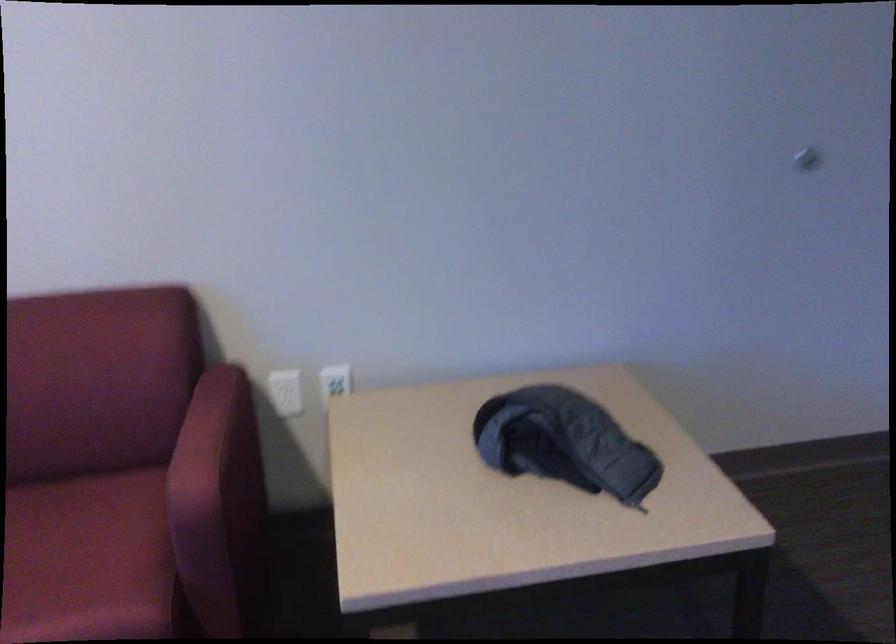
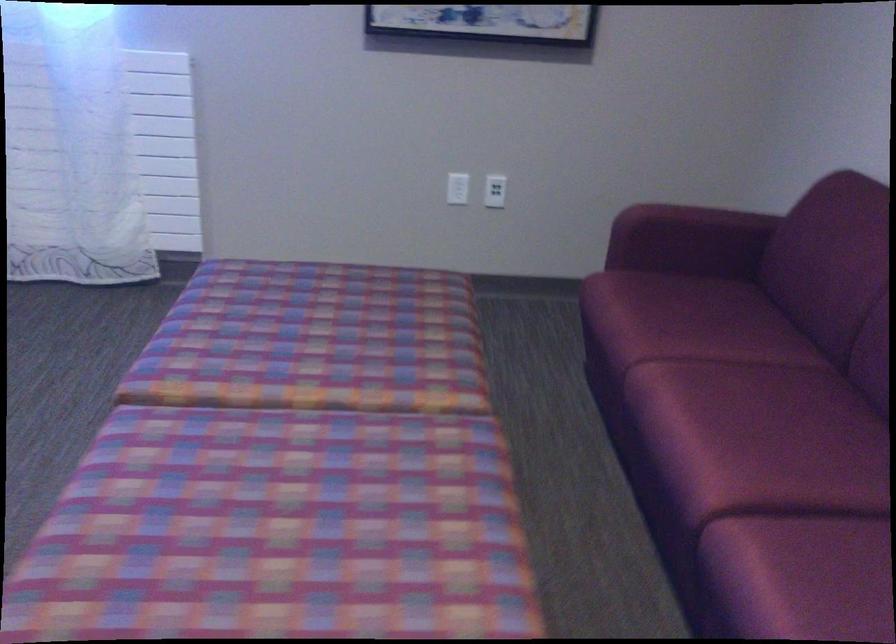
How did the camera likely rotate?

The camera rotated toward left-down.